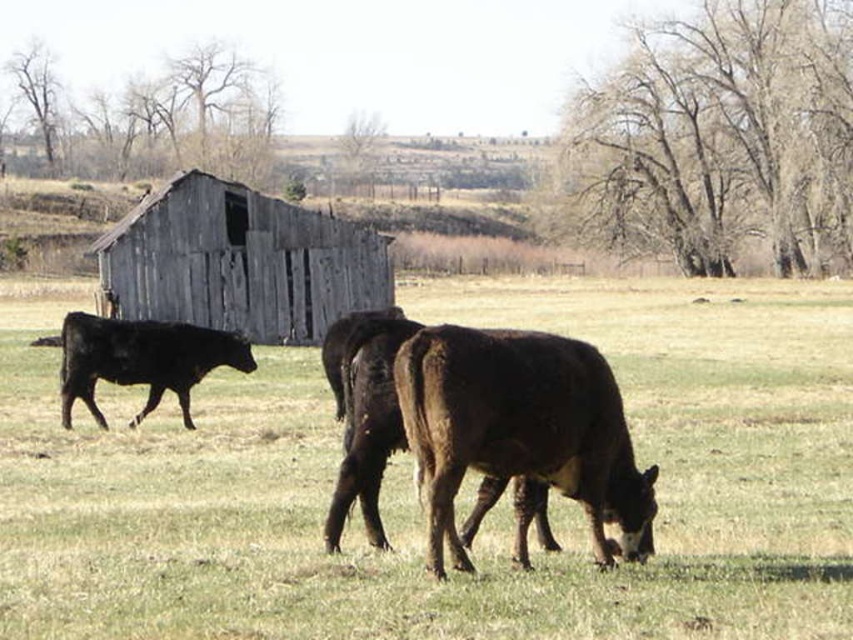
You are a farmer checking the field. You notice the black smooth cow at left and the weathered wood barn at upper left. Which object is closer to you?

The weathered wood barn at upper left is closer to you because the black smooth cow at left is behind it.

You are standing at the camera position and want to approach the brown rough textured bull at center. Which direction should you move to reach it?

Since the brown rough textured bull at center is located at point (519, 432), you should move forward towards the center of the image to reach it.

You are standing in the field and want to take a photo of the weathered wood barn at upper left and the black smooth cow at left. Which one should you focus on first if you want both to be in clear view?

The weathered wood barn at upper left is above the black smooth cow at left, so you should focus on the barn first to ensure both are in clear view.